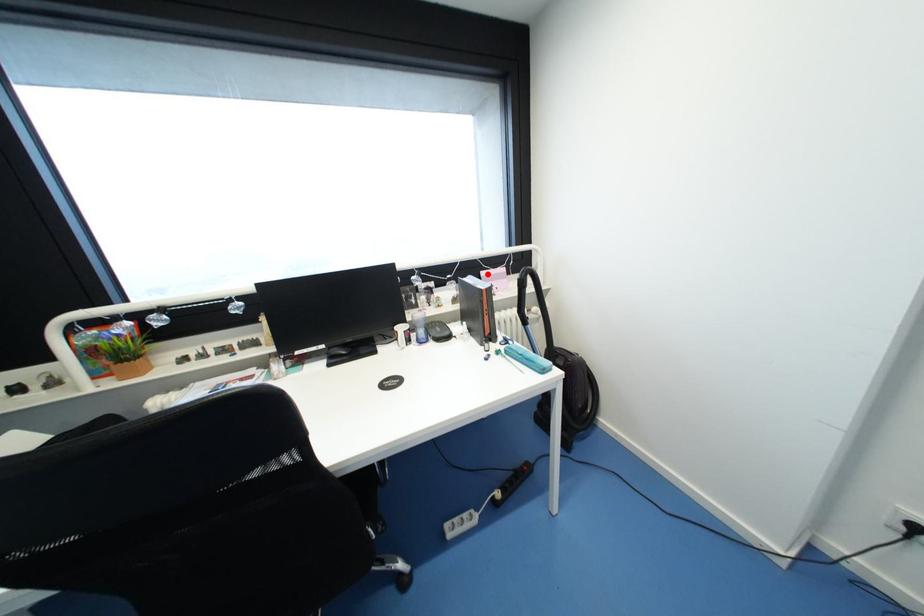
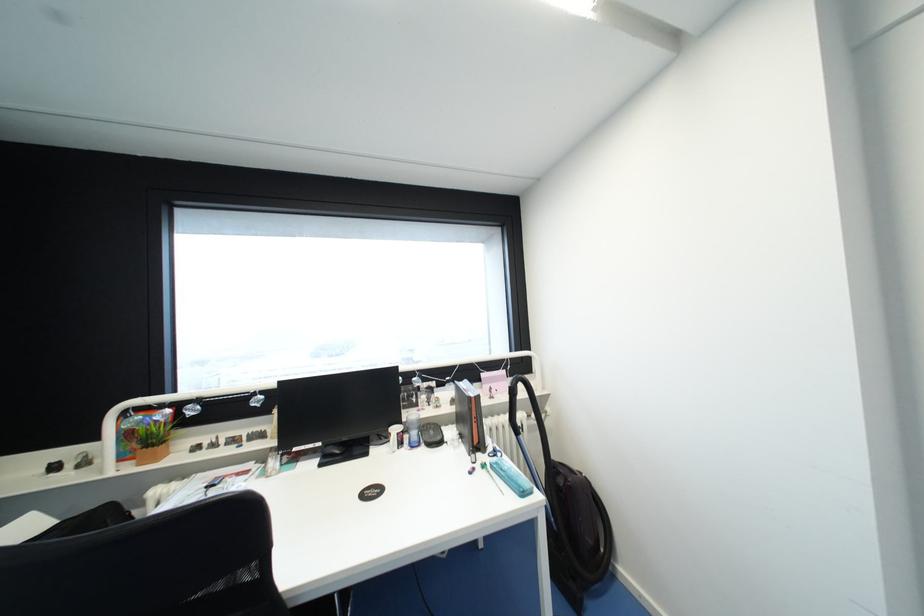
Question: I am providing you with two images of the same scene from different viewpoints. Image1 has a red point marked. In image2, the corresponding 3D location appears at what relative position? Reply with the corresponding letter.

Choices:
 (A) Closer
 (B) Farther

Answer: (B)